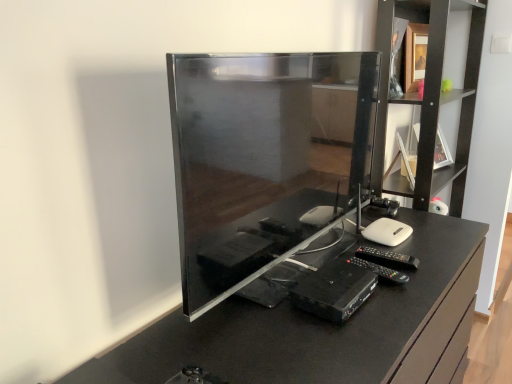
Question: From a real-world perspective, is black wood shelf at upper right under glossy black tv at center?

Choices:
 (A) yes
 (B) no

Answer: (B)

Question: Is black wood shelf at upper right not near glossy black tv at center?

Choices:
 (A) no
 (B) yes

Answer: (A)

Question: From the image's perspective, is black wood shelf at upper right above glossy black tv at center?

Choices:
 (A) no
 (B) yes

Answer: (B)

Question: Are black wood shelf at upper right and glossy black tv at center making contact?

Choices:
 (A) no
 (B) yes

Answer: (A)

Question: Can you confirm if black wood shelf at upper right is smaller than glossy black tv at center?

Choices:
 (A) yes
 (B) no

Answer: (A)

Question: Considering the relative sizes of black wood shelf at upper right and glossy black tv at center in the image provided, is black wood shelf at upper right bigger than glossy black tv at center?

Choices:
 (A) yes
 (B) no

Answer: (B)

Question: Is black wood shelf at upper right closer to camera compared to matte black desktop computer at center?

Choices:
 (A) no
 (B) yes

Answer: (A)

Question: Is matte black desktop computer at center completely or partially inside black wood shelf at upper right?

Choices:
 (A) no
 (B) yes

Answer: (A)

Question: Can you confirm if black wood shelf at upper right is smaller than matte black desktop computer at center?

Choices:
 (A) yes
 (B) no

Answer: (B)

Question: Is black wood shelf at upper right at the right side of matte black desktop computer at center?

Choices:
 (A) no
 (B) yes

Answer: (B)

Question: Is black wood shelf at upper right bigger than matte black desktop computer at center?

Choices:
 (A) yes
 (B) no

Answer: (A)

Question: Is black wood shelf at upper right looking in the opposite direction of matte black desktop computer at center?

Choices:
 (A) no
 (B) yes

Answer: (A)

Question: Does matte black desktop computer at center have a lesser height compared to glossy black tv at center?

Choices:
 (A) yes
 (B) no

Answer: (A)